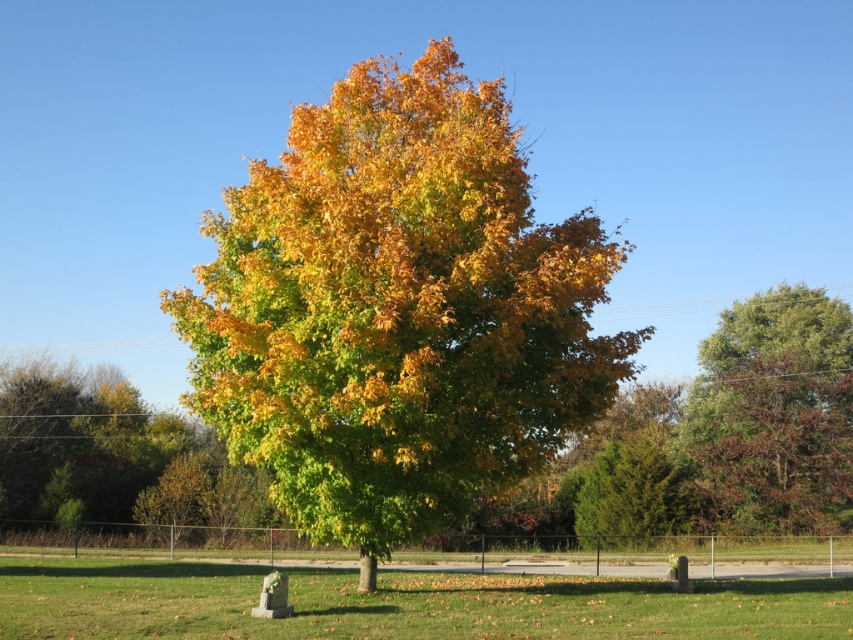
Between golden-green foliage at center and green leafy tree at right, which one is positioned lower?

green leafy tree at right is below.

Which is more to the right, golden-green foliage at center or green leafy tree at right?

From the viewer's perspective, green leafy tree at right appears more on the right side.

Is point (518, 186) behind point (788, 432)?

No.

Locate an element on the screen. golden-green foliage at center is located at coordinates (397, 308).